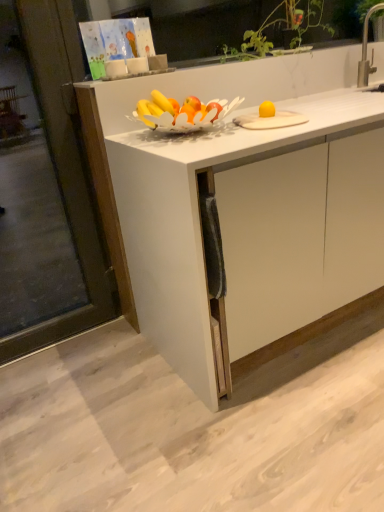
You are a GUI agent. You are given a task and a screenshot of the screen. Output one action in this format:
    pyautogui.click(x=<x>, y=<y>)
    Task: Click on the unoccupied region to the right of transparent glass screen door at left
    
    Given the screenshot: What is the action you would take?
    pyautogui.click(x=118, y=352)